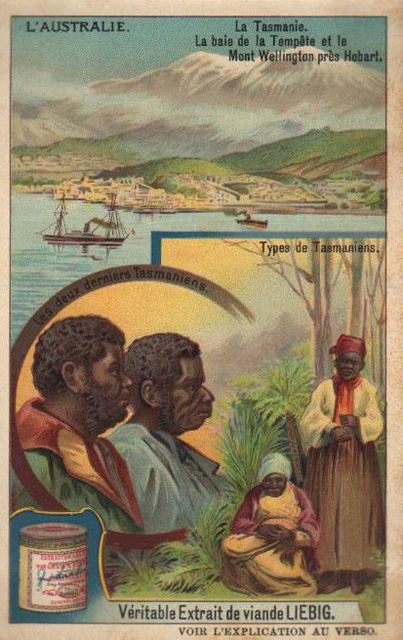
Question: Does matte brown dress at right appear under brown textured fabric at lower center?

Choices:
 (A) yes
 (B) no

Answer: (B)

Question: Does matte brown dress at right appear on the left side of brown textured fabric at lower center?

Choices:
 (A) yes
 (B) no

Answer: (B)

Question: Is the position of matte brown dress at right less distant than that of brown textured fabric at lower center?

Choices:
 (A) yes
 (B) no

Answer: (B)

Question: Which of the following is the closest to the observer?

Choices:
 (A) wooden ship at upper center
 (B) wooden ship at upper left
 (C) matte brown dress at right

Answer: (C)

Question: Which point is farther to the camera?

Choices:
 (A) (45, 355)
 (B) (124, 234)
 (C) (305, 428)
 (D) (257, 593)

Answer: (B)

Question: Estimate the real-world distances between objects in this image. Which object is farther from the wooden ship at upper left?

Choices:
 (A) wooden ship at upper center
 (B) dark skin textured face at center

Answer: (B)